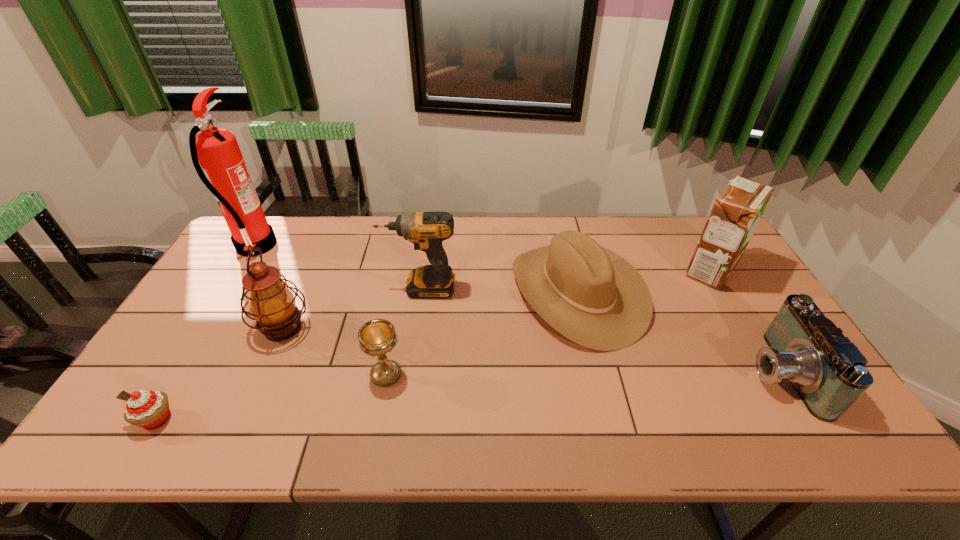
What are the coordinates of `object that is the fourth closest to the cowboy hat` in the screenshot? It's located at (377, 337).

Where is `object that is the fourth closest one to the camcorder`? The width and height of the screenshot is (960, 540). object that is the fourth closest one to the camcorder is located at coordinates (377, 337).

Locate an element on the screen. The image size is (960, 540). free space that satisfies the following two spatial constraints: 1. on the front-facing side of the camcorder; 2. on the front side of the chalice is located at coordinates (780, 374).

The width and height of the screenshot is (960, 540). I want to click on free space that satisfies the following two spatial constraints: 1. on the back side of the chalice; 2. on the left side of the shortest object, so click(183, 374).

Find the location of `blank space that satisfies the following two spatial constraints: 1. with the nozzle aimed from the cupcake; 2. on the right side of the tallest object`. blank space that satisfies the following two spatial constraints: 1. with the nozzle aimed from the cupcake; 2. on the right side of the tallest object is located at coordinates (150, 419).

Find the location of `vacant space that satisfies the following two spatial constraints: 1. on the straw side of the carton; 2. on the front side of the chalice`. vacant space that satisfies the following two spatial constraints: 1. on the straw side of the carton; 2. on the front side of the chalice is located at coordinates (772, 374).

Identify the location of free location that satisfies the following two spatial constraints: 1. on the back side of the cupcake; 2. on the left side of the third object from left to right. (211, 328).

What are the coordinates of `vacant space that satisfies the following two spatial constraints: 1. on the back side of the cupcake; 2. with the nozzle aimed from the tallest object` in the screenshot? It's located at (260, 246).

Where is `free spot that satisfies the following two spatial constraints: 1. on the back side of the chalice; 2. with the nozzle aimed from the fire extinguisher`? The image size is (960, 540). free spot that satisfies the following two spatial constraints: 1. on the back side of the chalice; 2. with the nozzle aimed from the fire extinguisher is located at coordinates (410, 246).